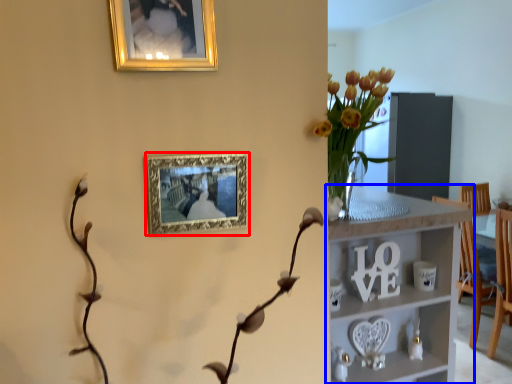
Question: Which of the following is the closest to the observer, picture frame (highlighted by a red box) or shelf (highlighted by a blue box)?

Choices:
 (A) picture frame
 (B) shelf

Answer: (A)